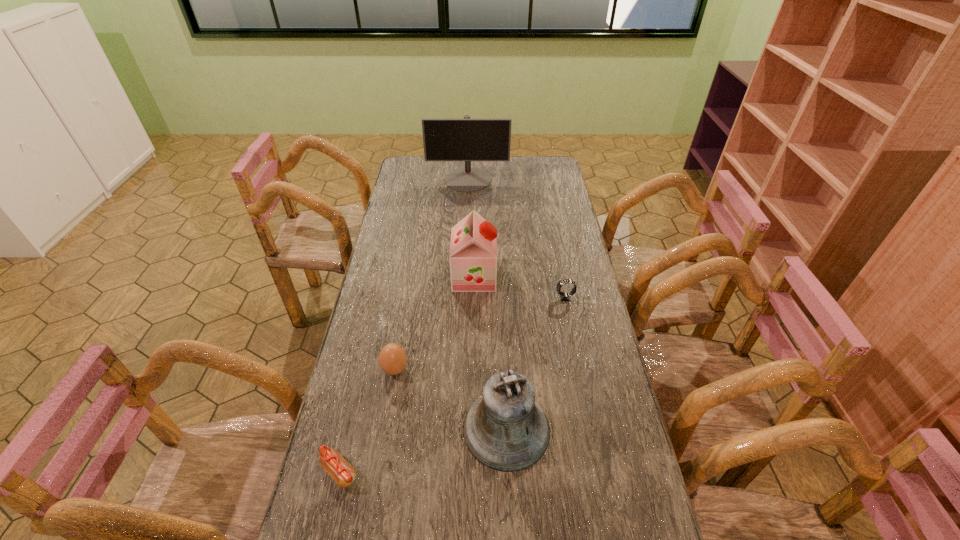
Locate an element on the screen. free space that satisfies the following two spatial constraints: 1. with the cap open on the soya milk; 2. on the front side of the fourth farthest object is located at coordinates (472, 369).